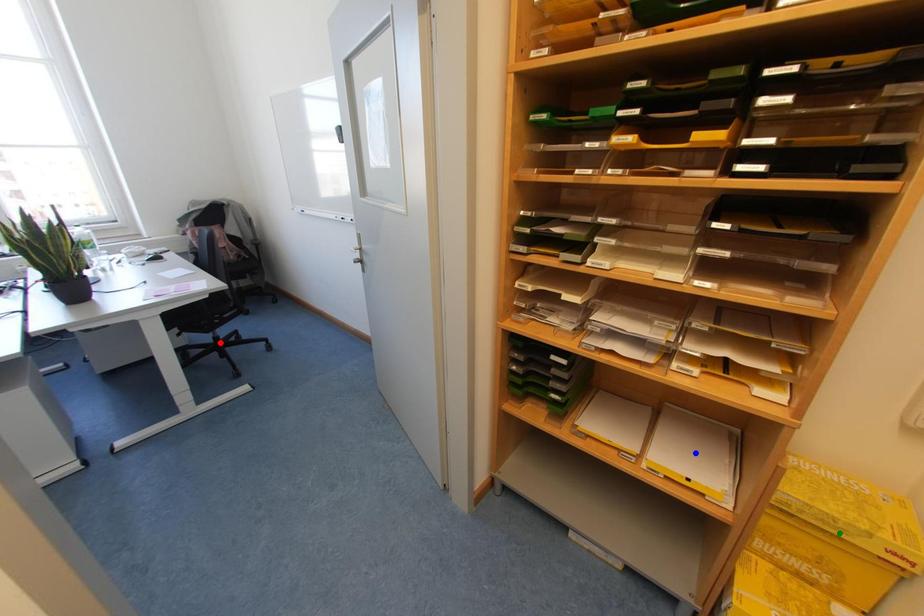
Order these from nearest to farthest:
blue point, green point, red point

green point → blue point → red point